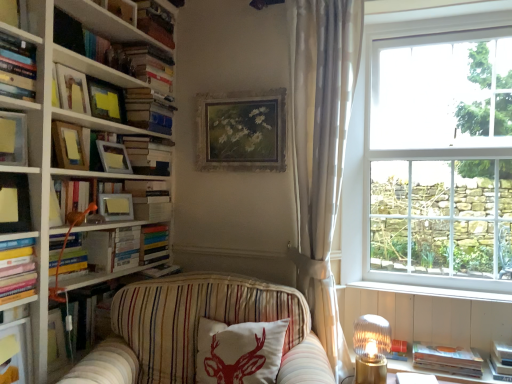
Question: Does matte orange book at left, which ranks as the 6th book in bottom-to-top order, have a smaller size compared to matte white shelf at lower left?

Choices:
 (A) yes
 (B) no

Answer: (B)

Question: Is matte orange book at left, placed as the 8th book when sorted from top to bottom, taller than matte white shelf at lower left?

Choices:
 (A) yes
 (B) no

Answer: (B)

Question: Can you confirm if matte orange book at left, placed as the 8th book when sorted from top to bottom, is shorter than matte white shelf at lower left?

Choices:
 (A) yes
 (B) no

Answer: (A)

Question: Is the surface of matte orange book at left, which ranks as the 6th book in bottom-to-top order, in direct contact with matte white shelf at lower left?

Choices:
 (A) yes
 (B) no

Answer: (B)

Question: Can you confirm if matte orange book at left, placed as the 8th book when sorted from top to bottom, is wider than matte white shelf at lower left?

Choices:
 (A) yes
 (B) no

Answer: (A)

Question: Can we say matte orange book at left, which ranks as the 6th book in bottom-to-top order, lies outside matte white shelf at lower left?

Choices:
 (A) yes
 (B) no

Answer: (A)

Question: From a real-world perspective, is gold-framed floral painting at upper center, which ranks as the sixth picture frame in left-to-right order, under hardcover books at upper left, which is counted as the tenth book, starting from the bottom?

Choices:
 (A) yes
 (B) no

Answer: (A)

Question: Considering the relative sizes of gold-framed floral painting at upper center, which ranks as the sixth picture frame in left-to-right order, and hardcover books at upper left, which is counted as the tenth book, starting from the bottom, in the image provided, is gold-framed floral painting at upper center, which ranks as the sixth picture frame in left-to-right order, smaller than hardcover books at upper left, which is counted as the tenth book, starting from the bottom,?

Choices:
 (A) yes
 (B) no

Answer: (B)

Question: Can you confirm if gold-framed floral painting at upper center, which is counted as the first picture frame, starting from the right, is thinner than hardcover books at upper left, which is counted as the tenth book, starting from the bottom?

Choices:
 (A) yes
 (B) no

Answer: (A)

Question: From a real-world perspective, is gold-framed floral painting at upper center, which ranks as the sixth picture frame in left-to-right order, on top of hardcover books at upper left, which is counted as the tenth book, starting from the bottom?

Choices:
 (A) no
 (B) yes

Answer: (A)

Question: Is gold-framed floral painting at upper center, which ranks as the sixth picture frame in left-to-right order, directly adjacent to hardcover books at upper left, which is counted as the fourth book, starting from the top?

Choices:
 (A) yes
 (B) no

Answer: (B)

Question: Considering the relative sizes of gold-framed floral painting at upper center, which ranks as the sixth picture frame in left-to-right order, and hardcover books at upper left, which is counted as the tenth book, starting from the bottom, in the image provided, is gold-framed floral painting at upper center, which ranks as the sixth picture frame in left-to-right order, bigger than hardcover books at upper left, which is counted as the tenth book, starting from the bottom,?

Choices:
 (A) no
 (B) yes

Answer: (B)

Question: Is matte white shelf at lower left positioned behind white sheer curtain at right?

Choices:
 (A) yes
 (B) no

Answer: (B)